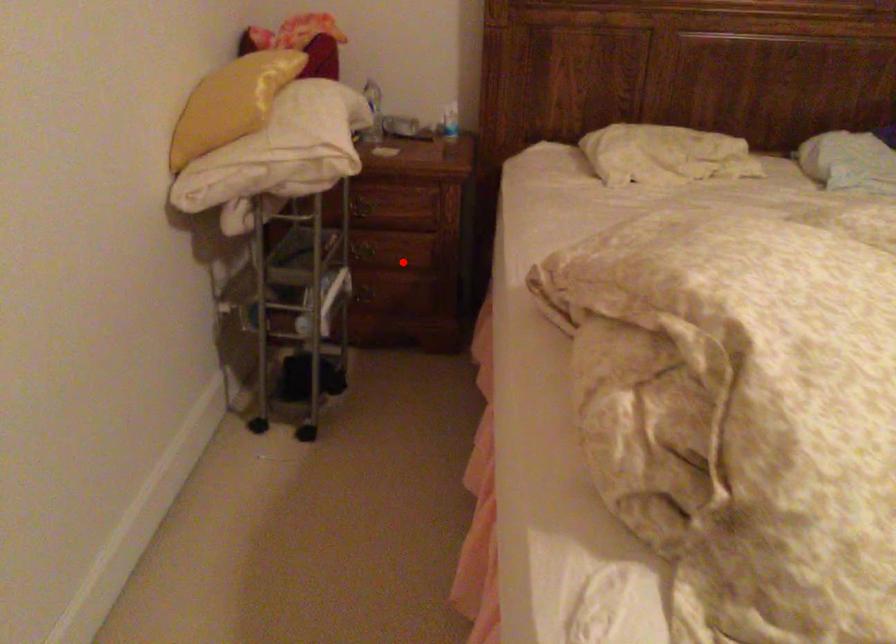
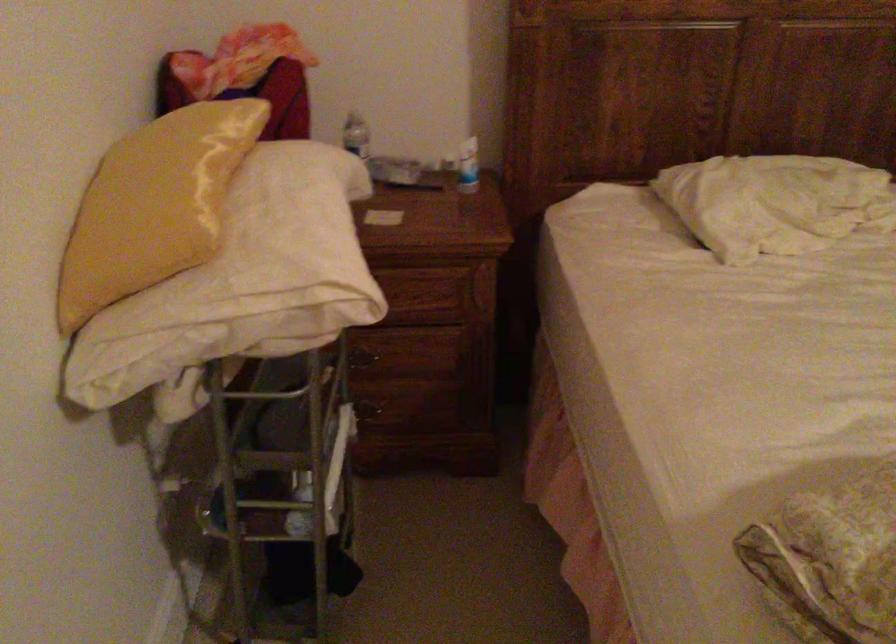
Question: I am providing you with two images of the same scene from different viewpoints. In image1, a red point is highlighted. Considering the same 3D point in image2, which of the following is correct?

Choices:
 (A) It is closer
 (B) It is farther

Answer: (A)